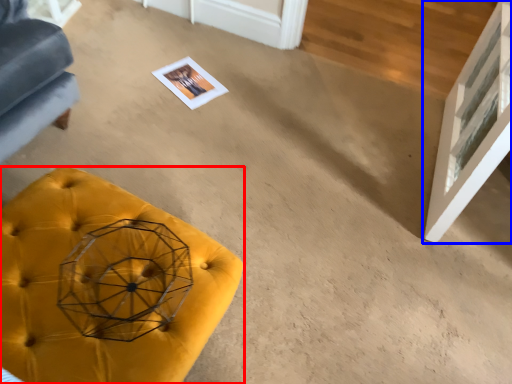
Question: Which point is further to the camera, furniture (highlighted by a red box) or glass door (highlighted by a blue box)?

Choices:
 (A) furniture
 (B) glass door

Answer: (B)